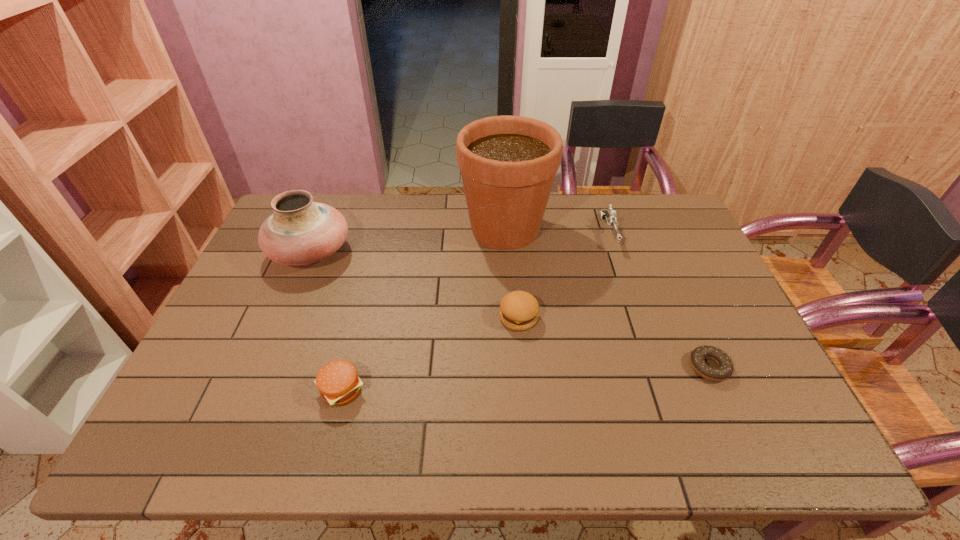
The height and width of the screenshot is (540, 960). What are the coordinates of `the rightmost object` in the screenshot? It's located at (724, 370).

The height and width of the screenshot is (540, 960). Find the location of `vacant region located on the front of the flowerpot`. vacant region located on the front of the flowerpot is located at coordinates (511, 309).

This screenshot has height=540, width=960. In order to click on free region located on the right of the pottery in this screenshot , I will do `click(371, 252)`.

Find the location of a particular element. The width and height of the screenshot is (960, 540). vacant space situated 0.200m aimed along the barrel of the fifth object from left to right is located at coordinates (632, 299).

At what (x,y) coordinates should I click in order to perform the action: click on free region located on the front of the right hamburger. Please return your answer as a coordinate pair (x, y). Looking at the image, I should click on 528,425.

You are a GUI agent. You are given a task and a screenshot of the screen. Output one action in this format:
    pyautogui.click(x=<x>, y=<y>)
    Task: Click on the vacant space located 0.080m on the front of the nearer hamburger
    
    Given the screenshot: What is the action you would take?
    pyautogui.click(x=327, y=447)

The width and height of the screenshot is (960, 540). In order to click on vacant space located on the back of the shortest object in this screenshot , I will do (x=662, y=261).

Locate an element on the screen. The width and height of the screenshot is (960, 540). flowerpot that is at the far edge is located at coordinates (508, 164).

At what (x,y) coordinates should I click in order to perform the action: click on pottery situated at the far edge. Please return your answer as a coordinate pair (x, y). Image resolution: width=960 pixels, height=540 pixels. Looking at the image, I should click on (300, 231).

This screenshot has height=540, width=960. I want to click on gun at the far edge, so click(610, 216).